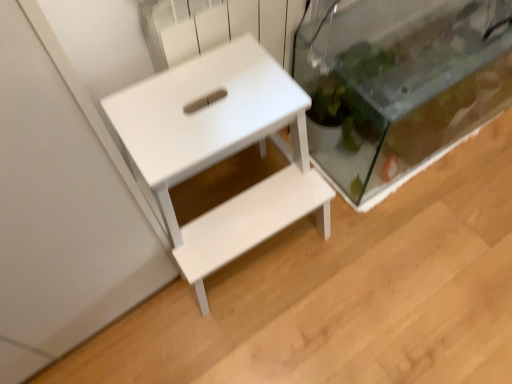
The image size is (512, 384). I want to click on free location in front of transparent glass tank at right, so click(419, 252).